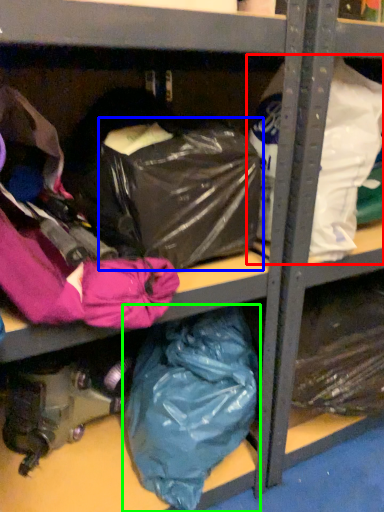
Question: Which is farther away from plastic bag (highlighted by a red box)? bag (highlighted by a blue box) or plastic bag (highlighted by a green box)?

Choices:
 (A) bag
 (B) plastic bag

Answer: (B)